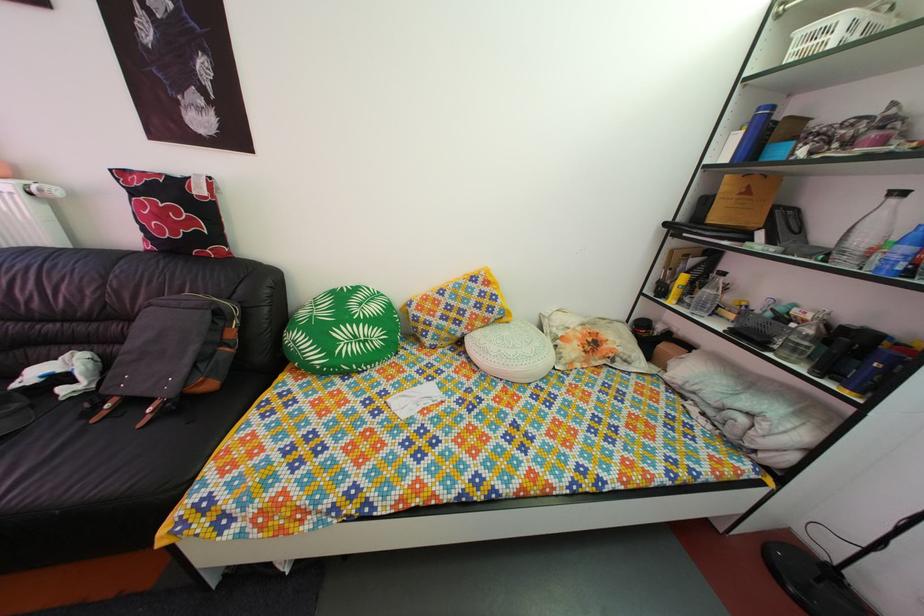
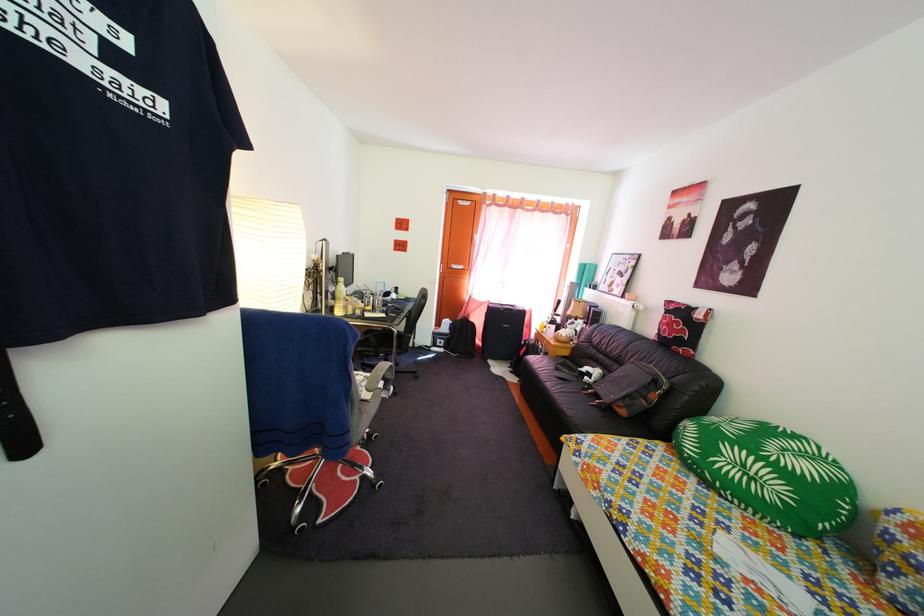
Question: Based on the continuous images, in which direction is the camera rotating? Reply with the corresponding letter.

Choices:
 (A) Left
 (B) Right
 (C) Up
 (D) Down

Answer: (A)